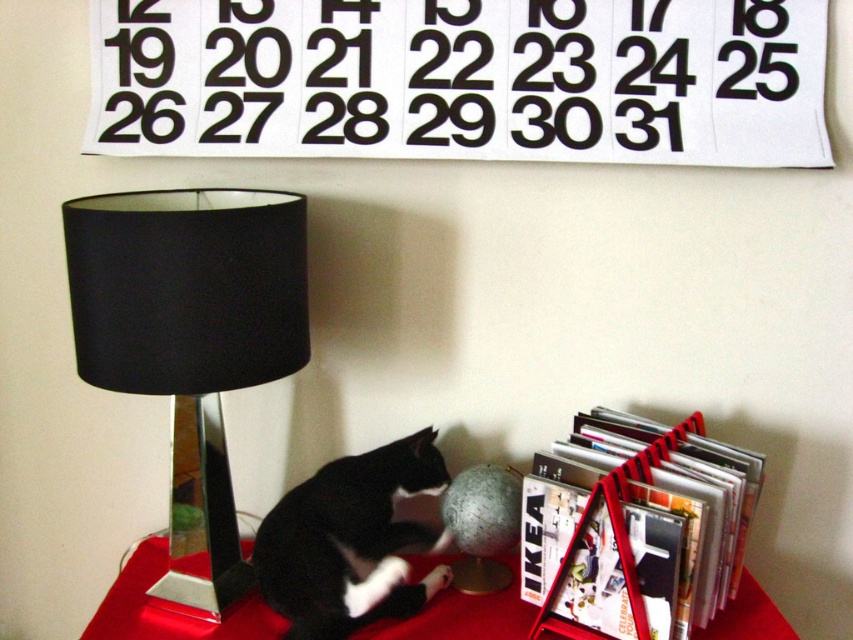
Question: Can you confirm if white paper calendar at upper center is positioned above black fabric lamp at left?

Choices:
 (A) no
 (B) yes

Answer: (B)

Question: Among these objects, which one is nearest to the camera?

Choices:
 (A) white paper calendar at upper center
 (B) smooth red table at center
 (C) black fabric lamp at left
 (D) black/white fur cat at center

Answer: (C)

Question: Is black/white fur cat at center closer to the viewer compared to smooth red table at center?

Choices:
 (A) yes
 (B) no

Answer: (A)

Question: Estimate the real-world distances between objects in this image. Which object is closer to the smooth red table at center?

Choices:
 (A) black/white fur cat at center
 (B) white paper calendar at upper center

Answer: (A)

Question: Which object is positioned farthest from the smooth red table at center?

Choices:
 (A) white paper calendar at upper center
 (B) black/white fur cat at center
 (C) black fabric lamp at left

Answer: (A)

Question: Observing the image, what is the correct spatial positioning of white paper calendar at upper center in reference to smooth red table at center?

Choices:
 (A) below
 (B) above

Answer: (B)